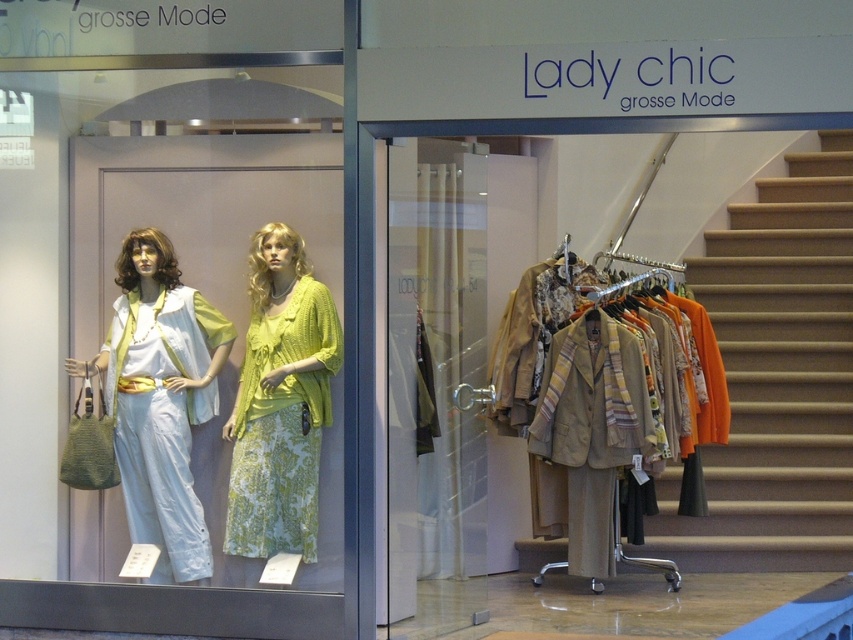
Looking at this image, you are a customer entering the store through the transparent glass door at center. After passing through the door, you want to reach the beige wool blazer at center. Since the door is much taller than the blazer, would you have to duck to avoid hitting your head on the door?

The transparent glass door at center is much taller than the beige wool blazer at center. Since the door is taller, you would not need to duck to avoid hitting your head when passing through the transparent glass door at center.

You are a delivery person carrying a beige wool blazer at center that is 3 feet wide. You approach the transparent glass door at center. Can you pass through the door without removing the blazer from your arms?

The transparent glass door at center is narrower than the beige wool blazer at center, so you cannot pass through the door without removing the blazer from your arms.